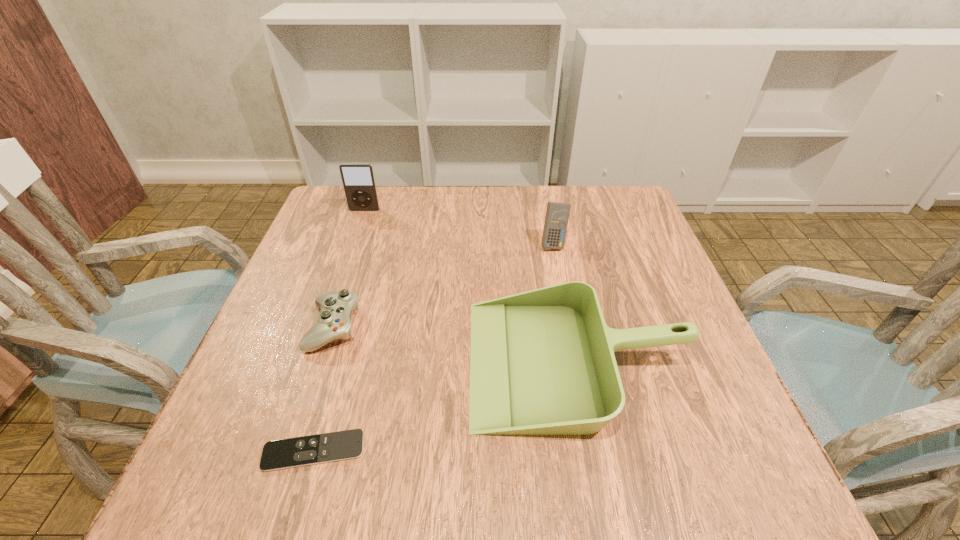
The width and height of the screenshot is (960, 540). Find the location of `vacant space positioned 0.210m on the scoop of the dustpan`. vacant space positioned 0.210m on the scoop of the dustpan is located at coordinates tap(361, 361).

You are a GUI agent. You are given a task and a screenshot of the screen. Output one action in this format:
    pyautogui.click(x=<x>, y=<y>)
    Task: Click on the vacant space situated 0.310m on the back of the control
    
    Given the screenshot: What is the action you would take?
    pyautogui.click(x=369, y=220)

Image resolution: width=960 pixels, height=540 pixels. Identify the location of free space located 0.290m on the back of the remote control. (356, 306).

Where is `object that is at the far edge`? object that is at the far edge is located at coordinates (358, 179).

Locate an element on the screen. object at the near edge is located at coordinates (314, 449).

Identify the location of iPod located at the left edge. (358, 179).

The width and height of the screenshot is (960, 540). I want to click on control at the left edge, so click(x=334, y=322).

Image resolution: width=960 pixels, height=540 pixels. What are the coordinates of `remote control that is at the left edge` in the screenshot? It's located at (314, 449).

I want to click on object that is at the right edge, so click(542, 362).

Where is `object located in the far left corner section of the desktop`? The image size is (960, 540). object located in the far left corner section of the desktop is located at coordinates (358, 179).